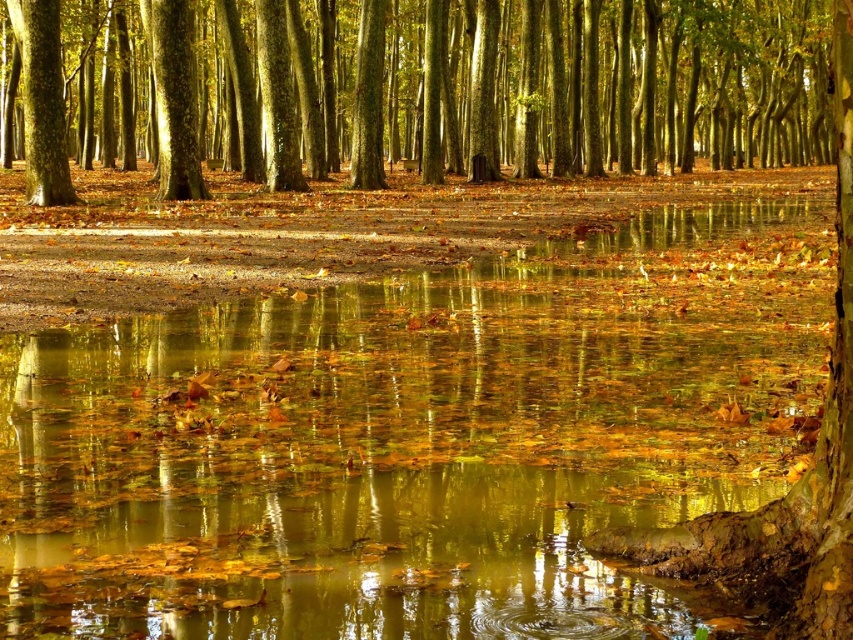
You are a hiker who wants to cross the forest from the left side to the right side. You see the smooth bark tree at left and the smooth brown tree trunk at upper left. How far apart are these two trees?

The distance between the smooth bark tree at left and the smooth brown tree trunk at upper left is 12.17 feet.

You are an artist trying to paint the autumnal forest scene. You want to ensure the size of the translucent golden leaves at center and the smooth bark tree at center are proportionally accurate. Which object should you paint as wider?

The smooth bark tree at center should be painted as wider because the translucent golden leaves at center are narrower than it according to the description.

You are standing at the edge of the water in the autumnal forest scene. You see the translucent golden leaves at center. Where exactly are they located in relation to your position?

The translucent golden leaves at center are located at point (x=415, y=440) in the scene.